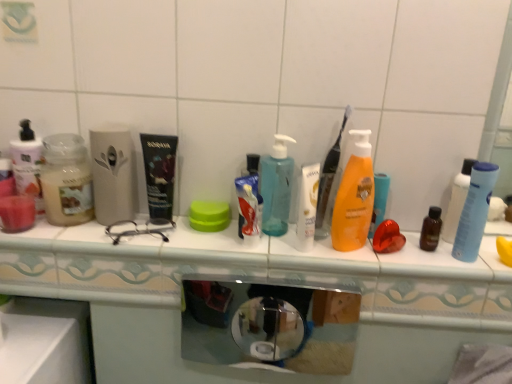
Find the location of a particular element. The height and width of the screenshot is (384, 512). free space to the left of white glossy toothpaste at center is located at coordinates (170, 238).